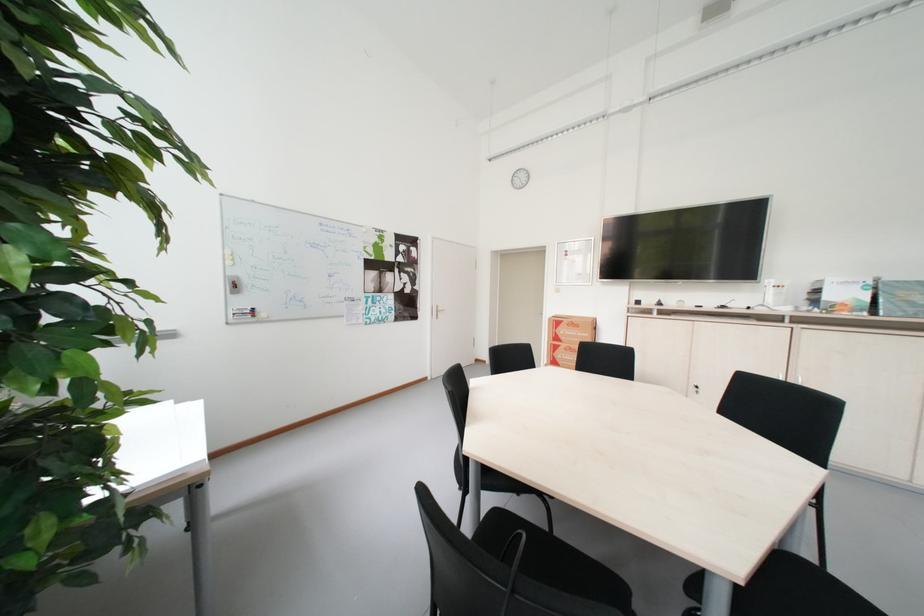
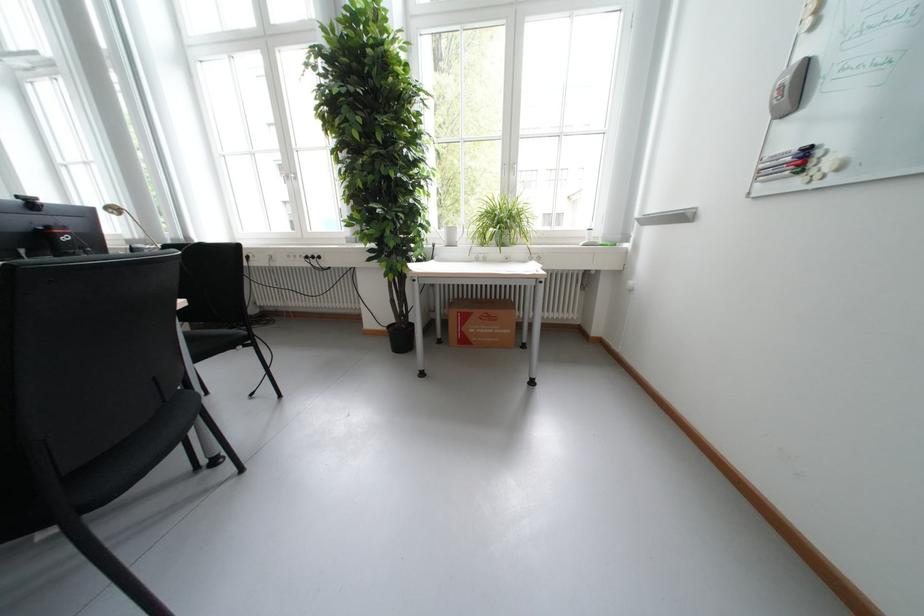
Where in the second image is the point corresponding to (x=263, y=321) from the first image?

(806, 184)